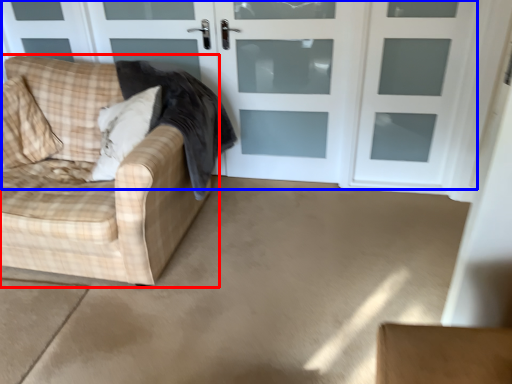
Question: Among these objects, which one is farthest to the camera, studio couch (highlighted by a red box) or door (highlighted by a blue box)?

Choices:
 (A) studio couch
 (B) door

Answer: (B)